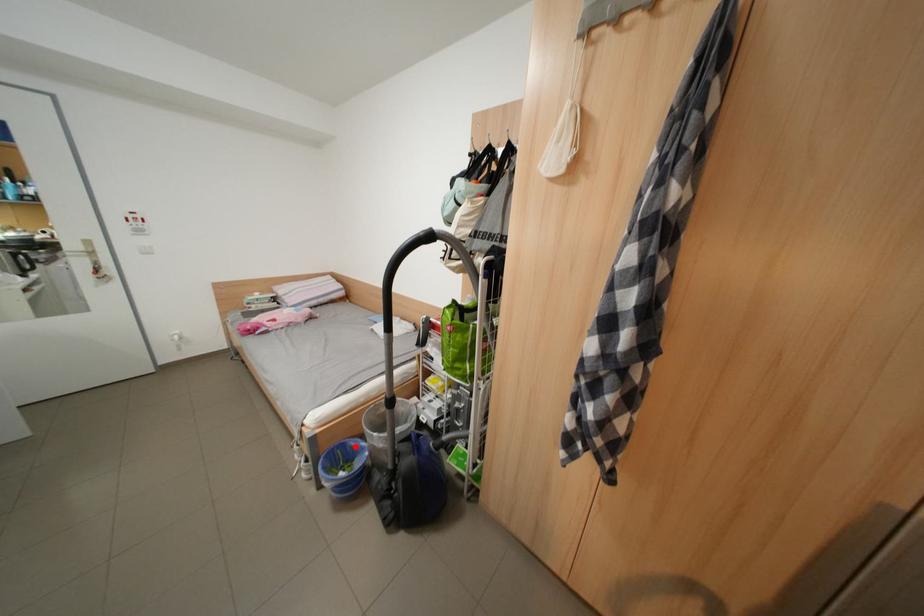
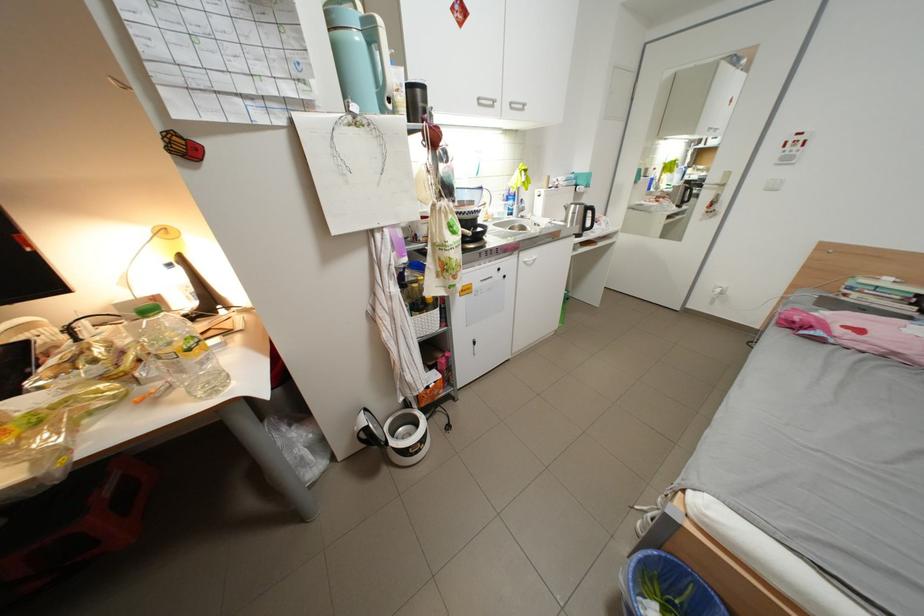
In the second image, find the point that corresponds to the highlighted location in the first image.

(716, 600)